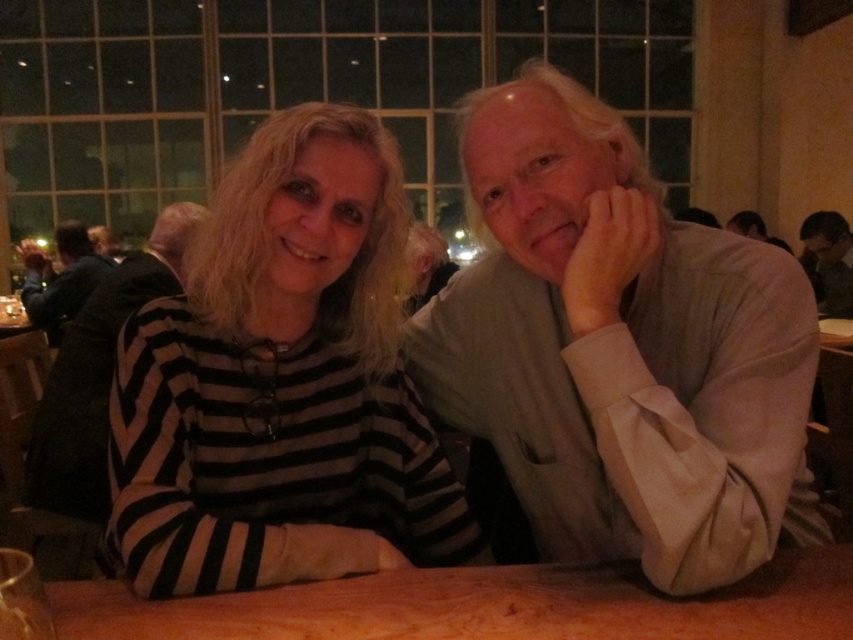
Question: Can you confirm if wooden table at center is positioned below matte gray sweater at center?

Choices:
 (A) yes
 (B) no

Answer: (A)

Question: Which of the following is the closest to the observer?

Choices:
 (A) (122, 616)
 (B) (38, 314)

Answer: (A)

Question: Considering the relative positions of dark gray sweater at left and smooth gray shirt at upper right in the image provided, where is dark gray sweater at left located with respect to smooth gray shirt at upper right?

Choices:
 (A) right
 (B) left

Answer: (B)

Question: Which of the following is the closest to the observer?

Choices:
 (A) (488, 568)
 (B) (80, 298)
 (C) (582, 124)
 (D) (73, 452)

Answer: (A)

Question: In this image, where is light beige shirt at center located relative to matte gray sweater at center?

Choices:
 (A) below
 (B) above

Answer: (A)

Question: Which point is closer to the camera taking this photo?

Choices:
 (A) (418, 470)
 (B) (846, 272)
 (C) (550, 621)
 (D) (111, 259)

Answer: (C)